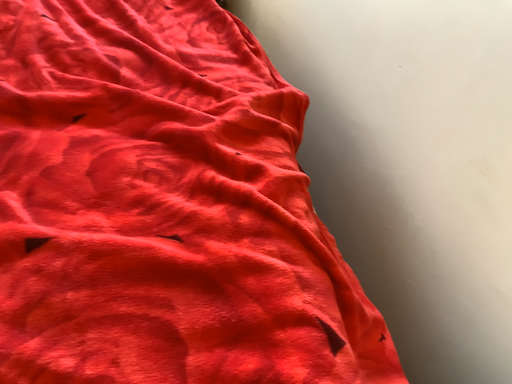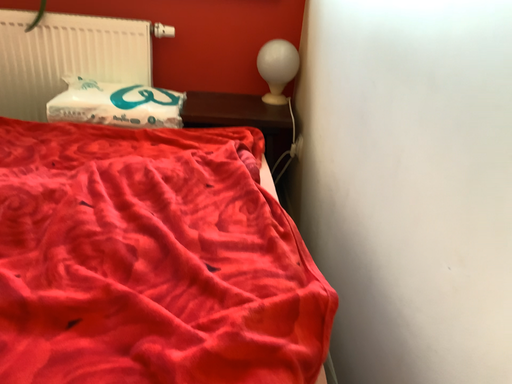
Question: How did the camera likely rotate when shooting the video?

Choices:
 (A) rotated downward
 (B) rotated upward

Answer: (B)